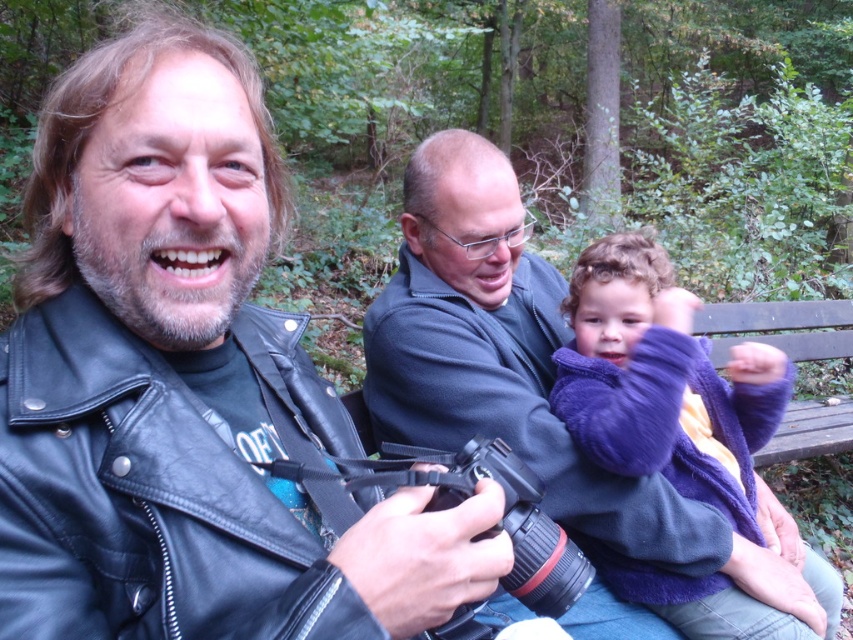
Looking at this image, which is below, dark blue fleece at center or purple fleece jacket at center?

purple fleece jacket at center is lower down.

Is dark blue fleece at center above purple fleece jacket at center?

Indeed, dark blue fleece at center is positioned over purple fleece jacket at center.

Who is more distant from viewer, (764, 508) or (746, 516)?

Positioned behind is point (764, 508).

You are a GUI agent. You are given a task and a screenshot of the screen. Output one action in this format:
    pyautogui.click(x=<x>, y=<y>)
    Task: Click on the dark blue fleece at center
    The width and height of the screenshot is (853, 640).
    Given the screenshot: What is the action you would take?
    pyautogui.click(x=532, y=380)

Is point (76, 621) positioned after point (699, 596)?

No, it is in front of (699, 596).

Is black leather jacket at left wider than purple fleece jacket at center?

No.

Who is more forward, (x=74, y=333) or (x=660, y=372)?

Point (x=74, y=333) is more forward.

Locate an element on the screen. The width and height of the screenshot is (853, 640). black leather jacket at left is located at coordinates (190, 387).

You are a GUI agent. You are given a task and a screenshot of the screen. Output one action in this format:
    pyautogui.click(x=<x>, y=<y>)
    Task: Click on the black leather jacket at left
    The width and height of the screenshot is (853, 640).
    Given the screenshot: What is the action you would take?
    pyautogui.click(x=190, y=387)

Is the position of black leather jacket at left more distant than that of dark blue fleece at center?

That is False.

Is point (80, 637) less distant than point (527, 424)?

Yes, it is.

Where is `black leather jacket at left`? The width and height of the screenshot is (853, 640). black leather jacket at left is located at coordinates (190, 387).